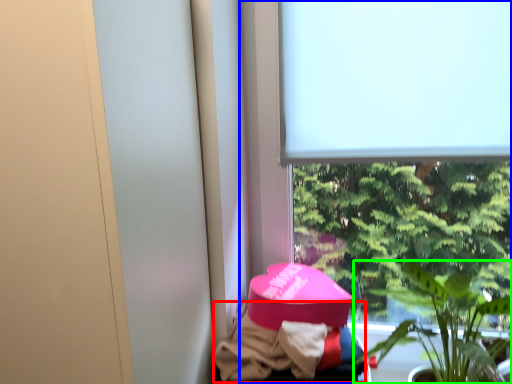
Question: Based on their relative distances, which object is nearer to clothing (highlighted by a red box)? Choose from window (highlighted by a blue box) and houseplant (highlighted by a green box).

Choices:
 (A) window
 (B) houseplant

Answer: (B)